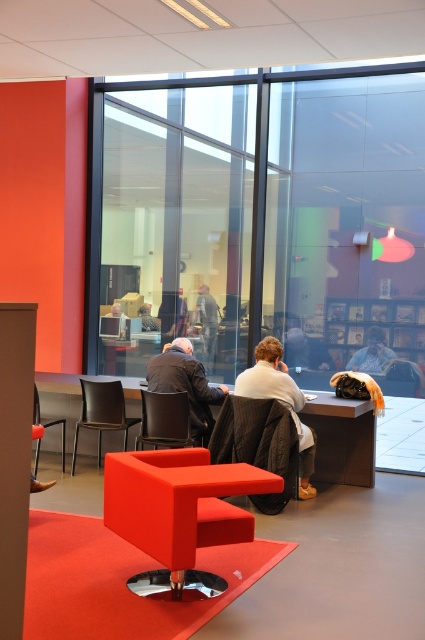
Who is higher up, matte red table at center or velvet-like brown chair at center?

matte red table at center is above.

Can you confirm if matte red table at center is thinner than velvet-like brown chair at center?

No.

Identify the location of matte red table at center. (178, 502).

Locate an element on the screen. The image size is (425, 640). matte red table at center is located at coordinates (178, 502).

Does matte red table at center have a larger size compared to smooth beige coat at center?

Correct, matte red table at center is larger in size than smooth beige coat at center.

Who is positioned more to the right, matte red table at center or smooth beige coat at center?

smooth beige coat at center is more to the right.

Who is more distant from viewer, [153,470] or [285,349]?

The point [285,349] is behind.

Find the location of `matte red table at center`. matte red table at center is located at coordinates (178, 502).

Is velvet-like brown chair at center to the left of matte black jacket at center from the viewer's perspective?

In fact, velvet-like brown chair at center is to the right of matte black jacket at center.

Between point (271, 401) and point (144, 308), which one is positioned in front?

Point (271, 401) is in front.

Describe the element at coordinates (257, 444) in the screenshot. I see `velvet-like brown chair at center` at that location.

You are a GUI agent. You are given a task and a screenshot of the screen. Output one action in this format:
    pyautogui.click(x=<x>, y=<y>)
    Task: Click on the velvet-like brown chair at center
    The width and height of the screenshot is (425, 640).
    Given the screenshot: What is the action you would take?
    pyautogui.click(x=257, y=444)